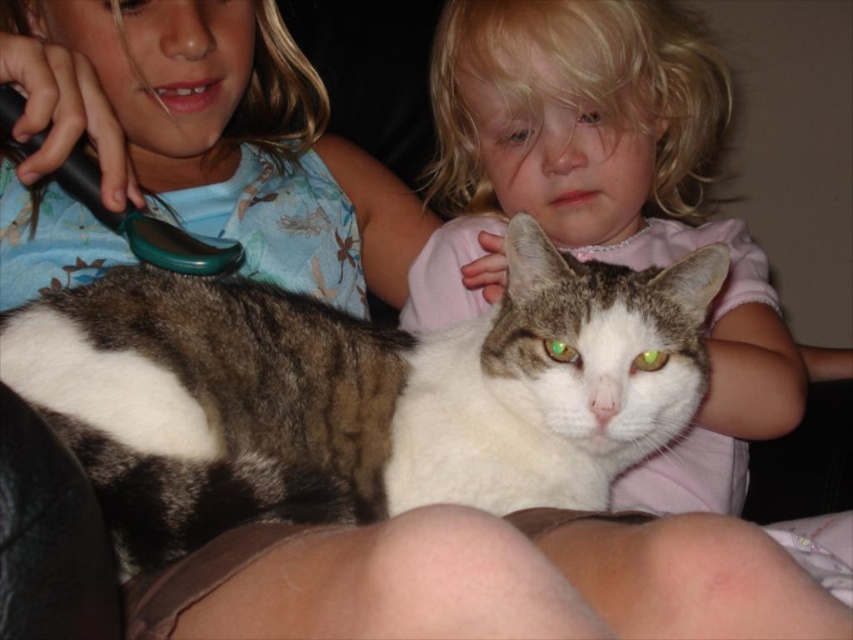
Describe the element at coordinates (358, 394) in the screenshot. I see `tabby fur cat at center` at that location.

Locate an element on the screen. tabby fur cat at center is located at coordinates (358, 394).

Does point (212, 378) come farther from viewer compared to point (738, 502)?

No, it is not.

Identify the location of tabby fur cat at center. Image resolution: width=853 pixels, height=640 pixels. (358, 394).